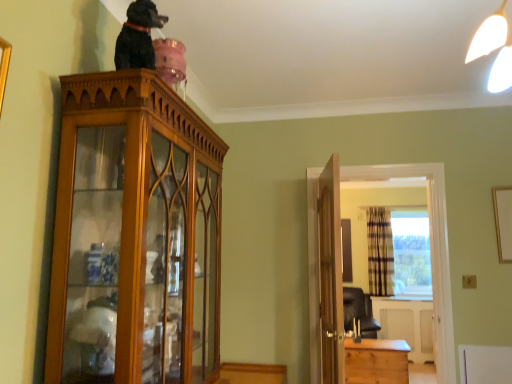
Describe the element at coordinates (376, 361) in the screenshot. I see `light brown wooden chest at lower right` at that location.

Find the location of `black glossy statue at upper center`. black glossy statue at upper center is located at coordinates (138, 36).

What is the approximate height of wooden cabinet at right?

It is 5.02 feet.

Identify the location of plaid fabric curtain at right. (x=380, y=251).

Where is `light brown wooden chest at lower right`? light brown wooden chest at lower right is located at coordinates (376, 361).

From the image's perspective, relative to wooden cabinet at upper left, is wooden cabinet at right above or below?

Clearly, from the image's perspective, wooden cabinet at right is below wooden cabinet at upper left.

From the picture: Which object is positioned more to the left, wooden cabinet at right or wooden cabinet at upper left?

wooden cabinet at upper left is more to the left.

Would you say wooden cabinet at right is outside wooden cabinet at upper left?

Yes, wooden cabinet at right is located beyond the bounds of wooden cabinet at upper left.

Who is shorter, wooden cabinet at right or wooden cabinet at upper left?

wooden cabinet at upper left is shorter.

From the image's perspective, which one is positioned lower, plaid fabric curtain at right or transparent glass window at center?

plaid fabric curtain at right appears lower in the image.

Based on the photo, is plaid fabric curtain at right facing towards transparent glass window at center?

No, plaid fabric curtain at right is not oriented towards transparent glass window at center.

Between plaid fabric curtain at right and transparent glass window at center, which one has larger size?

transparent glass window at center is bigger.

From a real-world perspective, which object rests below the other?

wooden door at center is physically lower.

From the image's perspective, is wooden cabinet at upper left located above or below wooden door at center?

Clearly, from the image's perspective, wooden cabinet at upper left is above wooden door at center.

Considering the sizes of objects wooden cabinet at upper left and wooden door at center in the image provided, who is taller, wooden cabinet at upper left or wooden door at center?

wooden door at center.

In the scene shown: Considering their positions, is wooden cabinet at right located in front of or behind black glossy statue at upper center?

wooden cabinet at right is behind black glossy statue at upper center.

From a real-world perspective, is wooden cabinet at right under black glossy statue at upper center?

Yes, from a real-world perspective, wooden cabinet at right is under black glossy statue at upper center.

From the image's perspective, relative to black glossy statue at upper center, is wooden cabinet at right above or below?

Based on their image positions, wooden cabinet at right is located beneath black glossy statue at upper center.

Can you confirm if wooden cabinet at right is taller than black glossy statue at upper center?

Yes, wooden cabinet at right is taller than black glossy statue at upper center.

Identify the location of entertainment center in front of the light brown wooden chest at lower right. The image size is (512, 384). [431, 250].

Is wooden cabinet at right positioned in front of light brown wooden chest at lower right?

Yes, it is.

Which is in front, point (451, 307) or point (379, 343)?

The point (451, 307) is closer to the camera.

Is wooden cabinet at right facing away from light brown wooden chest at lower right?

That's right, wooden cabinet at right is facing away from light brown wooden chest at lower right.

From a real-world perspective, is wooden door at center physically located above or below wooden cabinet at right?

In terms of real-world spatial position, wooden door at center is below wooden cabinet at right.

Based on the photo, who is taller, wooden door at center or wooden cabinet at right?

wooden cabinet at right.

You are a GUI agent. You are given a task and a screenshot of the screen. Output one action in this format:
    pyautogui.click(x=<x>, y=<y>)
    Task: Click on the entertainment center behind the wooden door at center
    
    Given the screenshot: What is the action you would take?
    pyautogui.click(x=431, y=250)

Does wooden door at center appear on the left side of wooden cabinet at right?

Correct, you'll find wooden door at center to the left of wooden cabinet at right.

Is wooden door at center facing away from light brown wooden chest at lower right?

wooden door at center does not have its back to light brown wooden chest at lower right.

Which object is thinner, wooden door at center or light brown wooden chest at lower right?

wooden door at center.

Would you say light brown wooden chest at lower right is part of wooden door at center's contents?

No, wooden door at center does not contain light brown wooden chest at lower right.

Between wooden door at center and light brown wooden chest at lower right, which one appears on the right side from the viewer's perspective?

light brown wooden chest at lower right is more to the right.

The height and width of the screenshot is (384, 512). Find the location of `entertainment center on the right of wooden cabinet at upper left`. entertainment center on the right of wooden cabinet at upper left is located at coordinates (431, 250).

At what (x,y) coordinates should I click in order to perform the action: click on curtain behind the transparent glass window at center. Please return your answer as a coordinate pair (x, y). Looking at the image, I should click on (380, 251).

Which object lies nearer to the anchor point black glossy statue at upper center, plaid fabric curtain at right or wooden door at center?

wooden door at center lies closer to black glossy statue at upper center than the other object.

Estimate the real-world distances between objects in this image. Which object is closer to black glossy statue at upper center, wooden cabinet at upper left or wooden cabinet at right?

wooden cabinet at upper left.

When comparing their distances from wooden cabinet at upper left, does plaid fabric curtain at right or black glossy statue at upper center seem closer?

Based on the image, black glossy statue at upper center appears to be nearer to wooden cabinet at upper left.

Based on the photo, when comparing their distances from wooden cabinet at right, does wooden door at center or light brown wooden chest at lower right seem further?

The object further to wooden cabinet at right is light brown wooden chest at lower right.

When comparing their distances from transparent glass window at center, does black glossy statue at upper center or plaid fabric curtain at right seem further?

black glossy statue at upper center lies further to transparent glass window at center than the other object.

Which object lies further to the anchor point wooden door at center, plaid fabric curtain at right or transparent glass window at center?

Among the two, transparent glass window at center is located further to wooden door at center.

When comparing their distances from transparent glass window at center, does black glossy statue at upper center or wooden cabinet at right seem closer?

Based on the image, wooden cabinet at right appears to be nearer to transparent glass window at center.

From the picture: Estimate the real-world distances between objects in this image. Which object is closer to light brown wooden chest at lower right, wooden cabinet at right or transparent glass window at center?

Based on the image, wooden cabinet at right appears to be nearer to light brown wooden chest at lower right.

This screenshot has width=512, height=384. Find the location of `table positioned between wooden door at center and transparent glass window at center from near to far`. table positioned between wooden door at center and transparent glass window at center from near to far is located at coordinates (376, 361).

Identify the location of window located between black glossy statue at upper center and plaid fabric curtain at right in the depth direction. The height and width of the screenshot is (384, 512). (398, 252).

You are a GUI agent. You are given a task and a screenshot of the screen. Output one action in this format:
    pyautogui.click(x=<x>, y=<y>)
    Task: Click on the entertainment center positioned between black glossy statue at upper center and light brown wooden chest at lower right from near to far
    
    Given the screenshot: What is the action you would take?
    pyautogui.click(x=431, y=250)

Where is `entertainment center positioned between wooden cabinet at upper left and plaid fabric curtain at right from near to far`? entertainment center positioned between wooden cabinet at upper left and plaid fabric curtain at right from near to far is located at coordinates (431, 250).